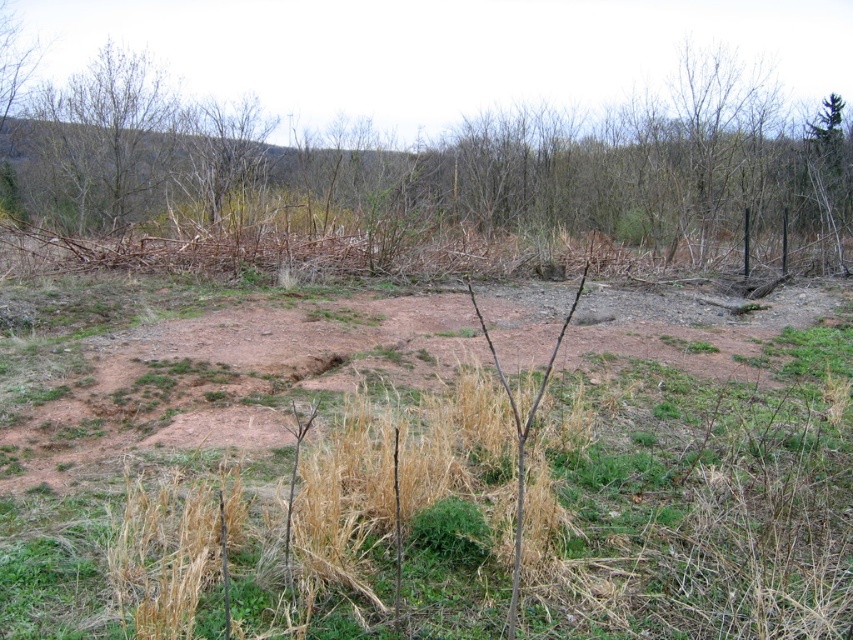
You are a landscape architect designing a garden and need to know the spatial relationship between the brown dry grass at upper center and the bare branches at upper left. Which object occupies a wider area in the scene?

The brown dry grass at upper center occupies a wider area than the bare branches at upper left, as its width is larger according to the description.